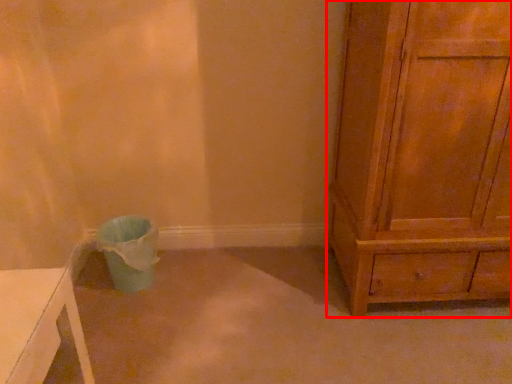
Question: In this image, where is chest of drawers (annotated by the red box) located relative to potty?

Choices:
 (A) left
 (B) right

Answer: (B)